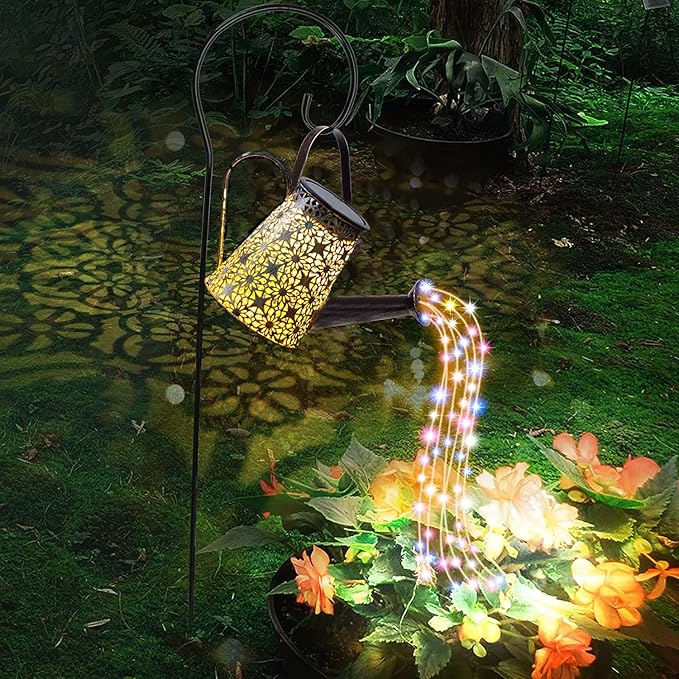
Find the location of a particular element. This screenshot has height=679, width=679. yellow light is located at coordinates (432, 498).